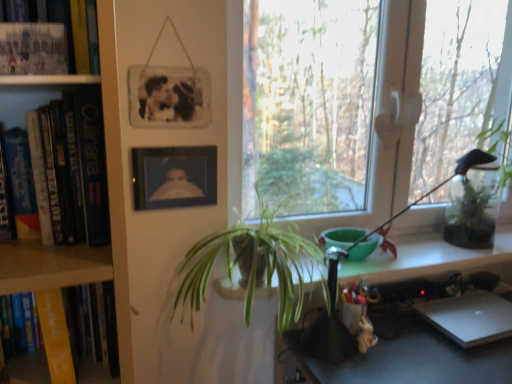
Question: In terms of width, does matte black photo frame at upper left, which is counted as the second book, starting from the top, look wider or thinner when compared to green leafy plant at right, the second houseplant from the left?

Choices:
 (A) wide
 (B) thin

Answer: (B)

Question: Which is correct: matte black photo frame at upper left, which is counted as the second book, starting from the top, is inside green leafy plant at right, the second houseplant from the left, or outside of it?

Choices:
 (A) outside
 (B) inside

Answer: (A)

Question: Which is farther from the silver metallic laptop at lower right?

Choices:
 (A) green leafy plant at right, which is the 1th houseplant from back to front
 (B) matte black picture frame at upper center, which is the 2th picture frame in top-to-bottom order
 (C) metallic silver desk at lower right
 (D) matte paper book at upper left, the 4th book from the bottom
 (E) green leafy plant at center, positioned as the second houseplant in right-to-left order

Answer: (D)

Question: Which is nearer to the matte black picture frame at upper center, which ranks as the first picture frame in bottom-to-top order?

Choices:
 (A) silver metallic laptop at lower right
 (B) hardcover book at left, which ranks as the third book in top-to-bottom order
 (C) yellow paperback book at left, acting as the 1th book starting from the bottom
 (D) green leafy plant at right, which is the 1th houseplant from back to front
 (E) black matte picture frame at upper center, marked as the 2th picture frame in a bottom-to-top arrangement

Answer: (E)